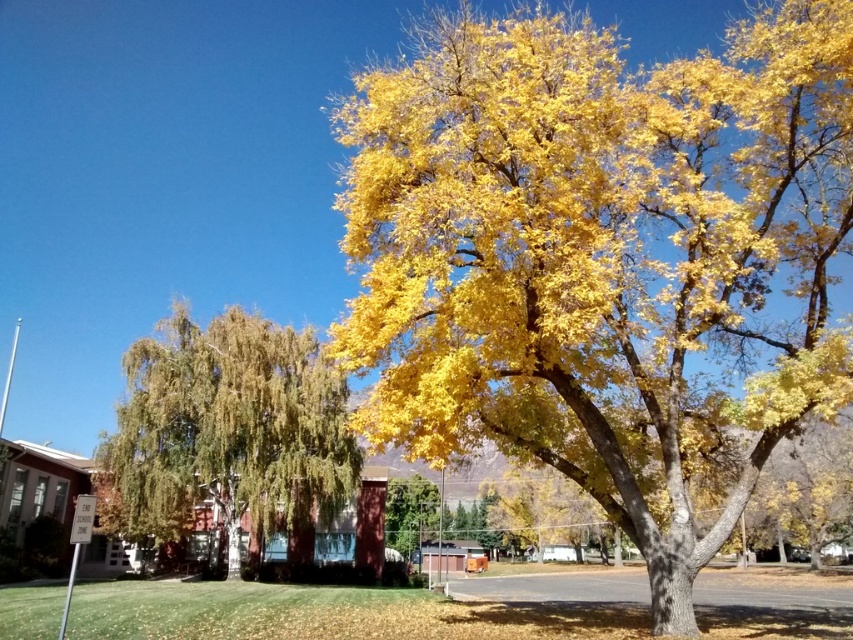
You are an artist planning to paint the scene. You want to ensure the golden leafy tree at center and the green leafy tree at left are proportionally accurate. Which tree should you paint larger in your artwork?

The golden leafy tree at center should be painted larger than the green leafy tree at left because it is bigger in the scene.

You are an arborist examining two trees in an autumn landscape. You observe the golden leafy tree at center and the green leafy tree at left. Which tree has a narrower trunk?

The golden leafy tree at center has a narrower trunk than the green leafy tree at left.